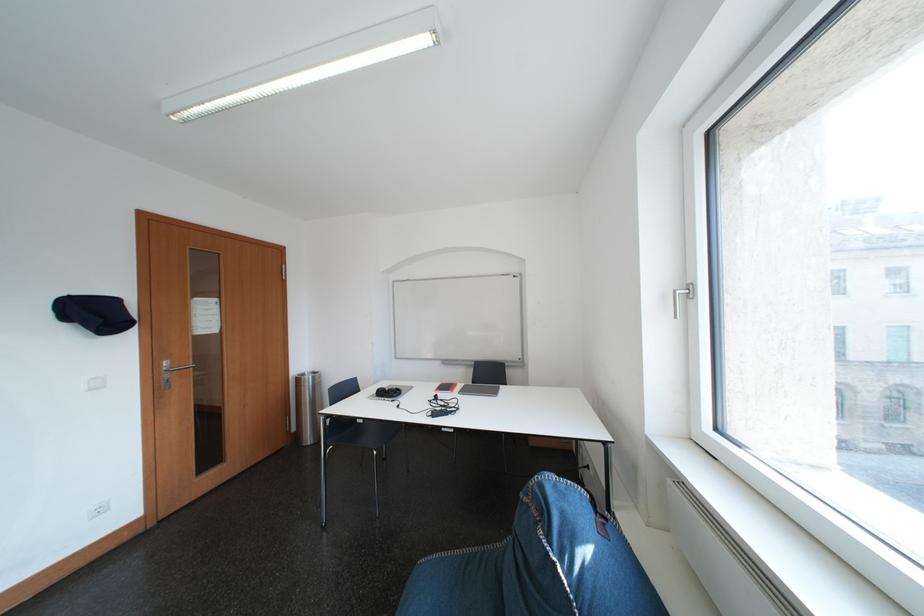
Locate an element on the screen. blue chair sitting surface is located at coordinates 466,594.